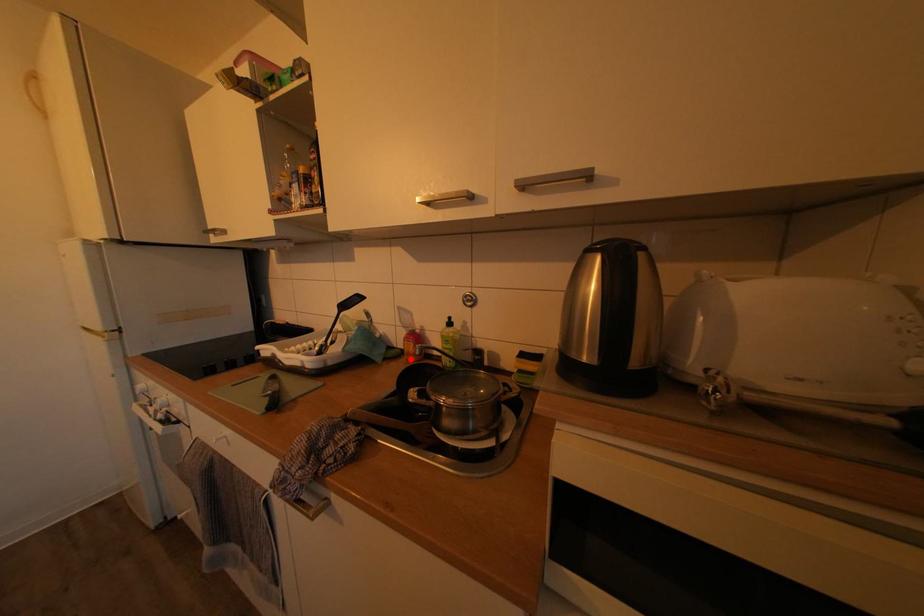
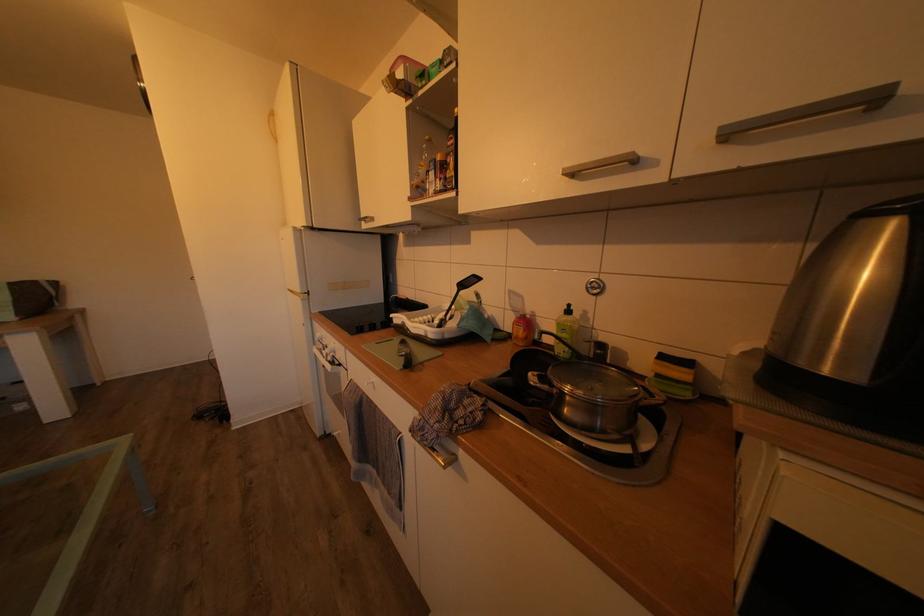
Question: I am providing you with two images of the same scene from different viewpoints. Image1 has a red point marked. In image2, the corresponding 3D location appears at what relative position? Reply with the corresponding letter.

Choices:
 (A) Closer
 (B) Farther

Answer: (A)